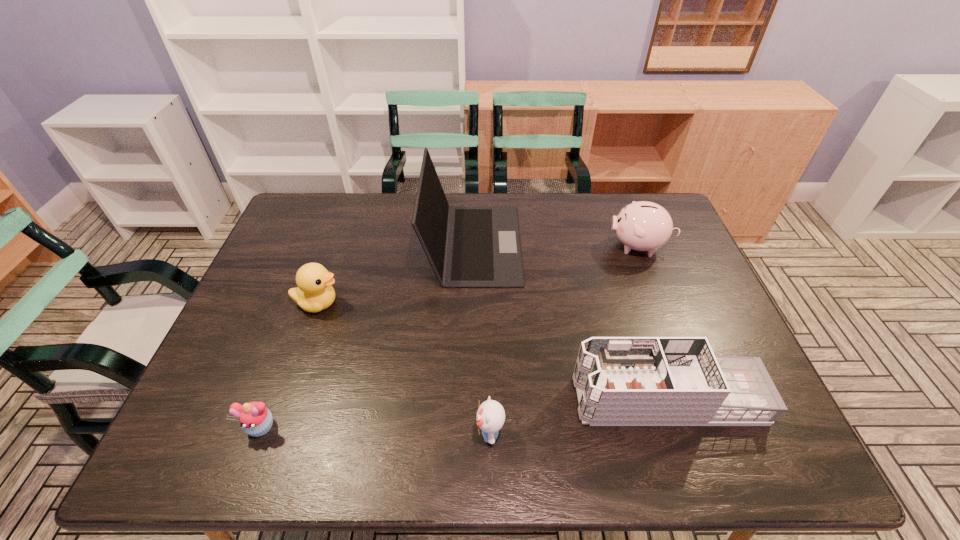
Where is `free spot between the dollhouse and the cupcake`? free spot between the dollhouse and the cupcake is located at coordinates (464, 413).

Where is `free area in between the cupcake and the kitten`? This screenshot has width=960, height=540. free area in between the cupcake and the kitten is located at coordinates (375, 430).

This screenshot has height=540, width=960. Find the location of `object that is the second closest to the piggy bank`. object that is the second closest to the piggy bank is located at coordinates (620, 381).

You are a GUI agent. You are given a task and a screenshot of the screen. Output one action in this format:
    pyautogui.click(x=<x>, y=<y>)
    Task: Click on the object that stands as the fourth closest to the dollhouse
    The width and height of the screenshot is (960, 540).
    Given the screenshot: What is the action you would take?
    pyautogui.click(x=314, y=293)

This screenshot has width=960, height=540. I want to click on vacant space that satisfies the following two spatial constraints: 1. on the face of the third farthest object; 2. on the face of the cupcake, so click(x=276, y=427).

This screenshot has width=960, height=540. I want to click on vacant area that satisfies the following two spatial constraints: 1. at the entrance of the dollhouse; 2. on the face of the cupcake, so (676, 427).

The height and width of the screenshot is (540, 960). In order to click on vacant region that satisfies the following two spatial constraints: 1. on the face of the duck; 2. on the face of the cupcake in this screenshot , I will do `click(276, 427)`.